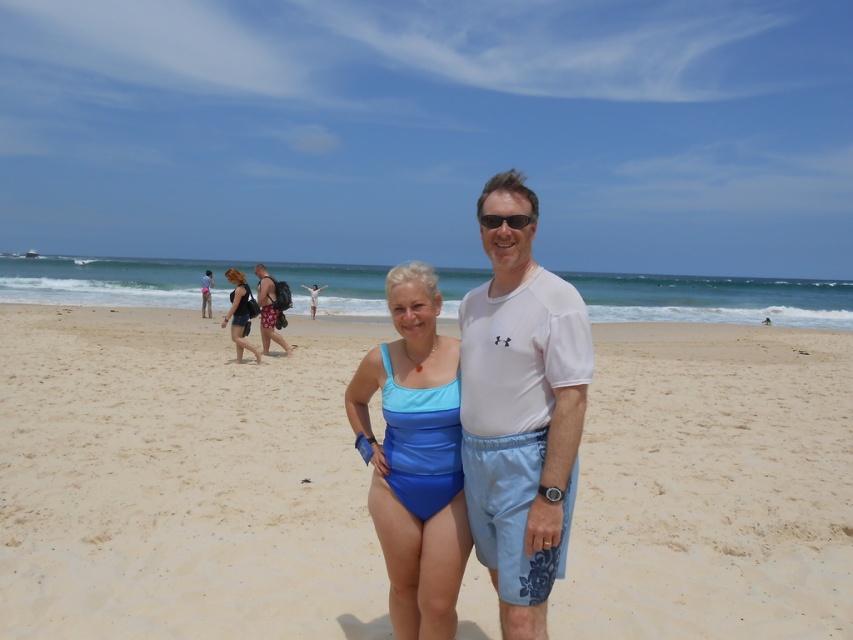
Question: Which point is farther from the camera taking this photo?

Choices:
 (A) (523, 216)
 (B) (258, 284)

Answer: (B)

Question: From the image, what is the correct spatial relationship of white sand at center in relation to matte black swimsuit at center?

Choices:
 (A) right
 (B) left

Answer: (A)

Question: Is white sand at center wider than blue matte swimsuit at center?

Choices:
 (A) yes
 (B) no

Answer: (A)

Question: Does white matte t-shirt at center appear over matte black swimsuit at center?

Choices:
 (A) yes
 (B) no

Answer: (B)

Question: Among these objects, which one is nearest to the camera?

Choices:
 (A) white matte t-shirt at center
 (B) blue matte swimsuit at center
 (C) black plastic sunglasses at center

Answer: (A)

Question: Which of the following is the farthest from the observer?

Choices:
 (A) black plastic sunglasses at center
 (B) blue fabric swimsuit at center
 (C) blue matte swimsuit at center
 (D) white matte t-shirt at center

Answer: (B)